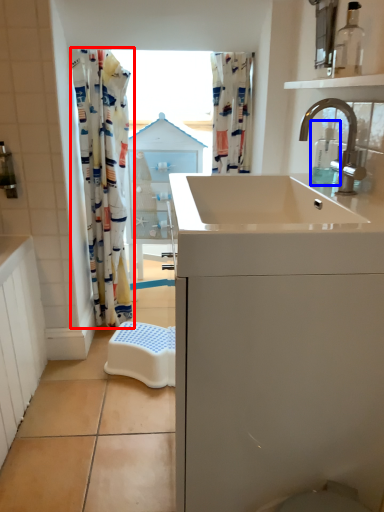
Question: Which object appears closest to the camera in this image, curtain (highlighted by a red box) or soap dispenser (highlighted by a blue box)?

Choices:
 (A) curtain
 (B) soap dispenser

Answer: (B)